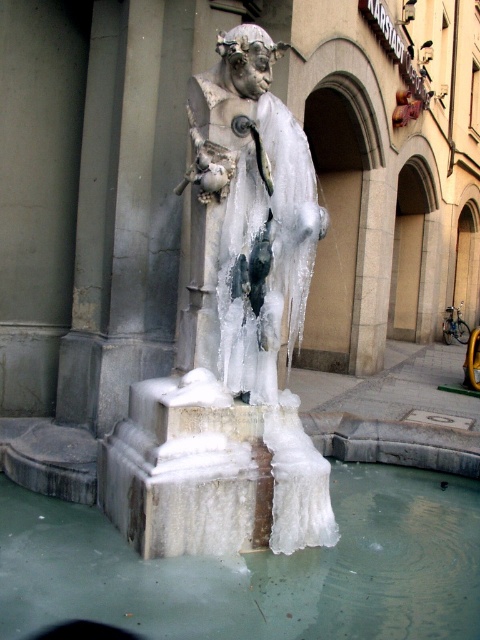
You are a delivery drone flying over a frozen public square. You need to land precisely on the clear ice water at center. What are the coordinates for the landing zone?

The coordinates for the landing zone on the clear ice water at center are at point (257,568).

You are a sculptor who wants to create a new ice sculpture that is wider than the existing one. Looking at the white frosted statue at center and the clear ice water at center, which one should you use as the base for your new sculpture to ensure it meets the width requirement?

The clear ice water at center has a greater width than the white frosted statue at center, so you should use the clear ice water at center as the base for your new sculpture to ensure it meets the width requirement.

You are standing in the public square and want to take a photo of the white frosted statue at center. If you are positioned at point 0.5, 0.5, will you be able to capture the entire statue in your camera frame?

The white frosted statue at center is located at point (230, 339). Since your position is at (240, 320), you are very close to the statue and may need to step back slightly to ensure the entire statue fits within your camera frame.